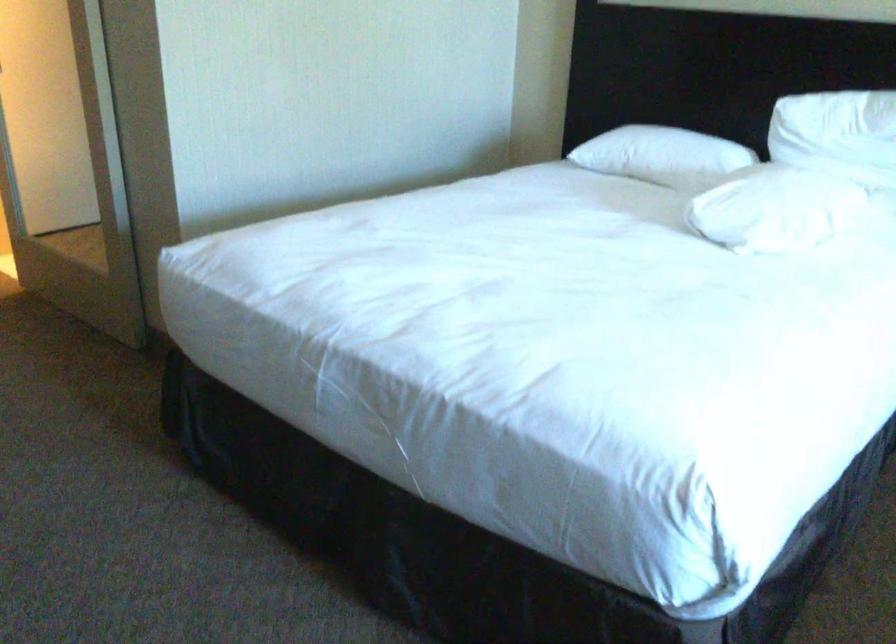
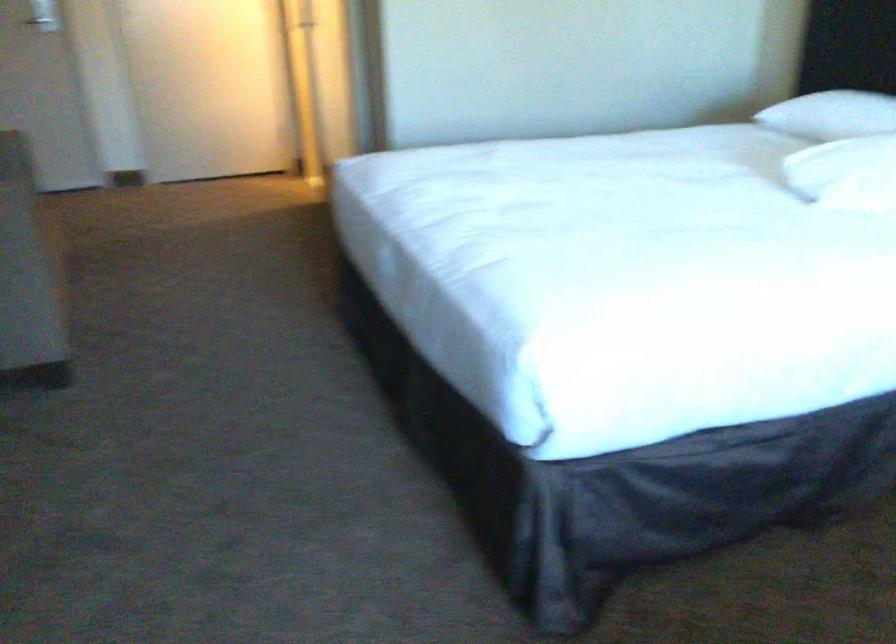
Question: In a continuous first-person perspective shot, in which direction is the camera moving?

Choices:
 (A) Left
 (B) Right
 (C) Forward
 (D) Backward

Answer: (B)